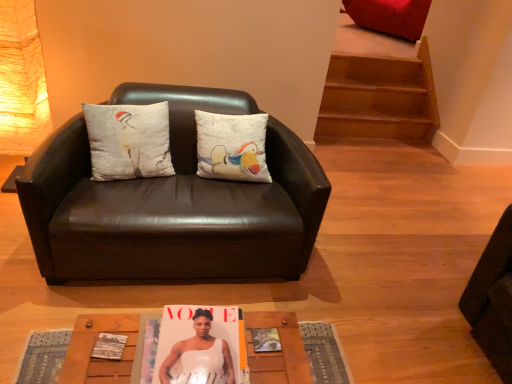
Based on the photo, what is the approximate width of matte paper magazine at center?

matte paper magazine at center is 3.65 inches in width.

This screenshot has width=512, height=384. I want to click on black leather couch at center, so click(x=172, y=203).

Find the location of a particular element. Image resolution: width=512 pixels, height=384 pixels. white glossy magazine at center is located at coordinates (199, 353).

Does black leather couch at center have a lesser width compared to white cotton cushion at center?

No.

From a real-world perspective, relative to white cotton cushion at center, is black leather couch at center vertically above or below?

In terms of real-world spatial position, black leather couch at center is below white cotton cushion at center.

Identify the location of pillow above the black leather couch at center (from a real-world perspective). (128, 141).

How many degrees apart are the facing directions of black leather couch at center and white cotton cushion at center?

12.1 degrees.

Is white cotton cushion at center at the back of wooden textured table at lower center?

wooden textured table at lower center does not have its back to white cotton cushion at center.

From the image's perspective, relative to white cotton cushion at center, is wooden textured table at lower center above or below?

wooden textured table at lower center is below white cotton cushion at center.

Considering the positions of objects wooden textured table at lower center and white cotton cushion at center in the image provided, who is more to the left, wooden textured table at lower center or white cotton cushion at center?

From the viewer's perspective, white cotton cushion at center appears more on the left side.

Is wooden textured table at lower center positioned beyond the bounds of white cotton cushion at center?

Yes.

Relative to white cotton cushion at center, is matte paper magazine at center in front or behind?

Visually, matte paper magazine at center is located in front of white cotton cushion at center.

Is point (104, 351) behind point (125, 112)?

No.

Measure the distance from matte paper magazine at center to white cotton cushion at center.

They are 1.05 meters apart.

Considering the sizes of objects matte paper magazine at center and white cotton cushion at center in the image provided, who is wider, matte paper magazine at center or white cotton cushion at center?

With larger width is white cotton cushion at center.

Which object is positioned more to the right, wooden textured table at lower center or white glossy magazine at center?

Positioned to the right is white glossy magazine at center.

Is white glossy magazine at center at the back of wooden textured table at lower center?

No, white glossy magazine at center is not at the back of wooden textured table at lower center.

Is wooden textured table at lower center outside of white glossy magazine at center?

Yes, wooden textured table at lower center is located beyond the bounds of white glossy magazine at center.

Between wooden textured table at lower center and white glossy magazine at center, which one has more height?

Standing taller between the two is white glossy magazine at center.

Where is `person that is in front of the wooden textured table at lower center`? This screenshot has height=384, width=512. person that is in front of the wooden textured table at lower center is located at coordinates (199, 353).

Is white glossy magazine at center looking in the opposite direction of wooden textured table at lower center?

No, white glossy magazine at center is not facing away from wooden textured table at lower center.

Is white glossy magazine at center at the left side of wooden textured table at lower center?

In fact, white glossy magazine at center is to the right of wooden textured table at lower center.

Between white glossy magazine at center and wooden textured table at lower center, which one is positioned in front?

white glossy magazine at center is more forward.

Which is farther from the camera, (183, 375) or (98, 346)?

The point (98, 346) is farther.

Is white glossy magazine at center looking in the opposite direction of matte paper magazine at center?

Correct, white glossy magazine at center is looking away from matte paper magazine at center.

Between white glossy magazine at center and matte paper magazine at center, which one has smaller width?

matte paper magazine at center.

Considering the points (102, 358) and (184, 313), which point is in front, point (102, 358) or point (184, 313)?

The point (102, 358) is closer.

Consider the image. In the image, is matte paper magazine at center positioned in front of or behind white glossy magazine at center?

Clearly, matte paper magazine at center is behind white glossy magazine at center.

From a real-world perspective, is matte paper magazine at center positioned above or below white glossy magazine at center?

In terms of real-world spatial position, matte paper magazine at center is below white glossy magazine at center.

Locate an element on the screen. This screenshot has height=384, width=512. pillow above the black leather couch at center (from the image's perspective) is located at coordinates click(x=128, y=141).

Locate an element on the screen. The height and width of the screenshot is (384, 512). table on the right side of white cotton cushion at center is located at coordinates (92, 348).

Estimate the real-world distances between objects in this image. Which object is further from wooden textured table at lower center, white glossy magazine at center or black leather couch at center?

black leather couch at center.

When comparing their distances from matte paper magazine at center, does white cotton cushion at center or wooden textured table at lower center seem closer?

wooden textured table at lower center.

Which object lies further to the anchor point white cotton cushion at center, wooden textured table at lower center or matte paper magazine at center?

Among the two, wooden textured table at lower center is located further to white cotton cushion at center.

When comparing their distances from white cotton cushion at center, does black leather couch at center or wooden textured table at lower center seem further?

Among the two, wooden textured table at lower center is located further to white cotton cushion at center.

Which object lies further to the anchor point black leather couch at center, white glossy magazine at center or matte paper magazine at center?

matte paper magazine at center is further to black leather couch at center.

Which object lies further to the anchor point white glossy magazine at center, matte paper magazine at center or wooden textured table at lower center?

matte paper magazine at center is positioned further to the anchor white glossy magazine at center.

Estimate the real-world distances between objects in this image. Which object is closer to white glossy magazine at center, wooden textured table at lower center or white cotton cushion at center?

The object closer to white glossy magazine at center is wooden textured table at lower center.

From the image, which object appears to be nearer to white cotton cushion at center, matte paper magazine at center or black leather couch at center?

Answer: black leather couch at center is positioned closer to the anchor white cotton cushion at center.

Find the location of a particular element. magazine between white glossy magazine at center and wooden textured table at lower center along the z-axis is located at coordinates (109, 346).

Locate an element on the screen. magazine between black leather couch at center and white glossy magazine at center from top to bottom is located at coordinates (109, 346).

Find the location of `magazine between white cotton cushion at center and wooden textured table at lower center in the vertical direction`. magazine between white cotton cushion at center and wooden textured table at lower center in the vertical direction is located at coordinates (109, 346).

Locate an element on the screen. This screenshot has width=512, height=384. person between white cotton cushion at center and wooden textured table at lower center in the up-down direction is located at coordinates (199, 353).